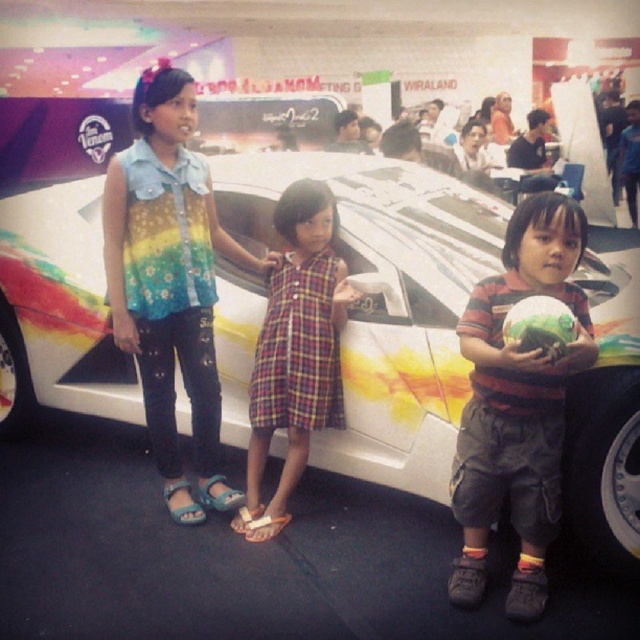
You are a photographer at the car exhibition. You need to take a photo of the white glossy car at center and the striped cotton shirt at center. Given that the camera can only capture objects within a 2.5 meter width, will both objects fit in the frame?

The white glossy car at center is larger in width than the striped cotton shirt at center. Since the car is wider, if the car alone exceeds 2.5 meters, the shirt might also be too small to be clearly captured. However, without exact measurements, it is uncertain if both will fit within the camera frame.